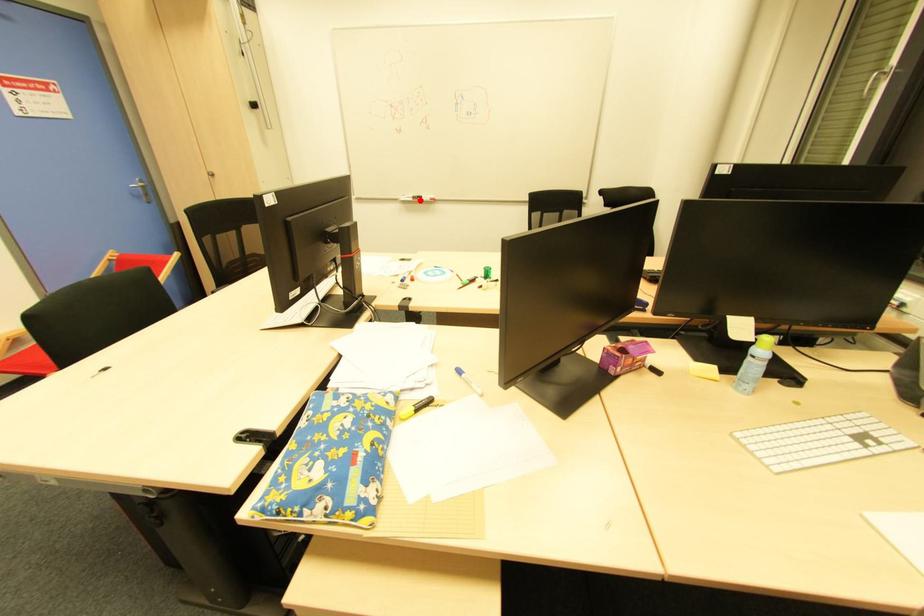
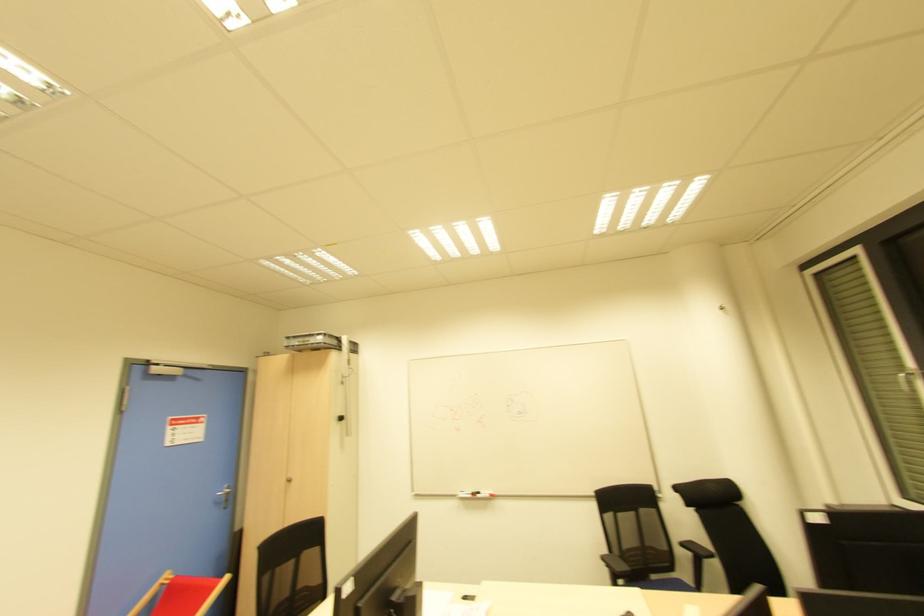
The point at the highlighted location is marked in the first image. Where is the corresponding point in the second image?

(478, 496)